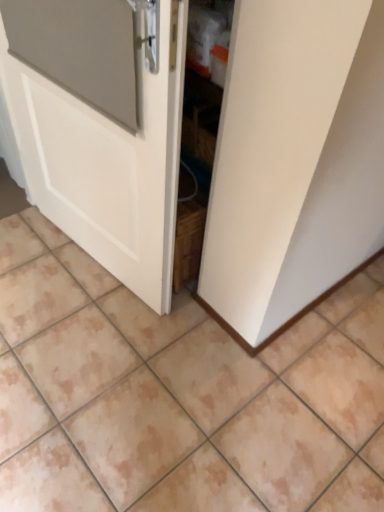
At what (x,y) coordinates should I click in order to perform the action: click on vacant space in front of white matte door at center. Please return your answer as a coordinate pair (x, y). Looking at the image, I should click on (90, 352).